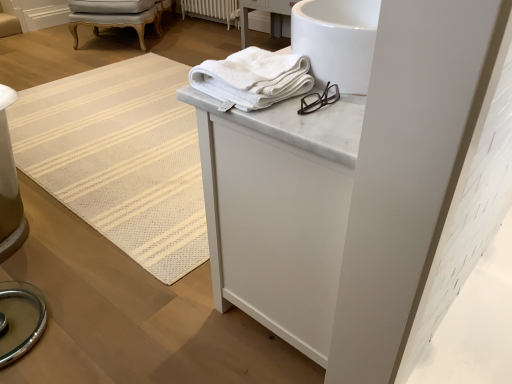
At what (x,y) coordinates should I click in order to perform the action: click on empty space that is ontop of white textured mat at upper center. Please return your answer as a coordinate pair (x, y). Looking at the image, I should click on (109, 110).